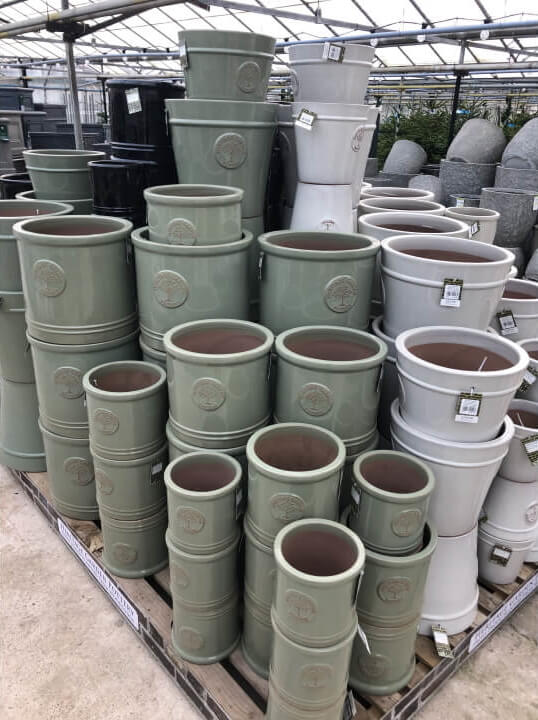
You are a GUI agent. You are given a task and a screenshot of the screen. Output one action in this format:
    pyautogui.click(x=<x>, y=<y>)
    Task: Click on the gray pot
    The image size is (538, 720).
    Given the screenshot: What is the action you would take?
    pyautogui.click(x=464, y=145)